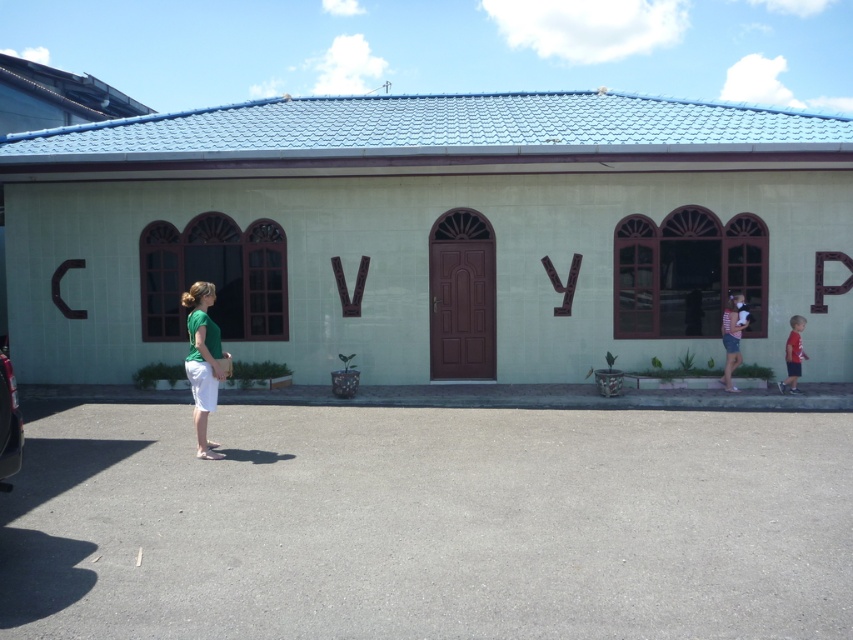
Question: Can you confirm if green matte shorts at lower left is positioned to the right of red cotton shirt at right?

Choices:
 (A) yes
 (B) no

Answer: (B)

Question: Among these objects, which one is nearest to the camera?

Choices:
 (A) matte white shirt at right
 (B) metallic silver car at left

Answer: (B)

Question: Among these points, which one is nearest to the camera?

Choices:
 (A) 795,376
 (B) 19,433

Answer: (B)

Question: Does green matte shorts at lower left appear under metallic silver car at left?

Choices:
 (A) no
 (B) yes

Answer: (A)

Question: Can you confirm if green matte shorts at lower left is thinner than red cotton shirt at right?

Choices:
 (A) no
 (B) yes

Answer: (A)

Question: Which point appears farthest from the camera in this image?

Choices:
 (A) (184, 294)
 (B) (15, 422)
 (C) (788, 342)
 (D) (724, 364)

Answer: (D)